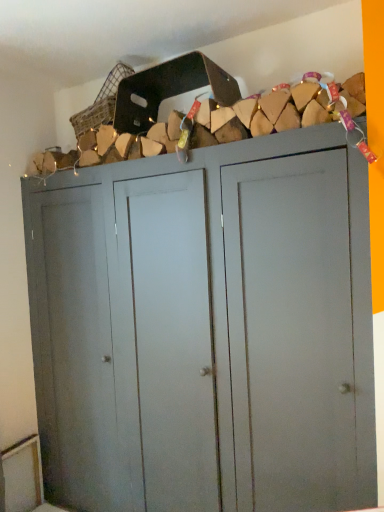
Describe the element at coordinates (101, 102) in the screenshot. I see `woven wicker basket at upper center` at that location.

Identify the location of woven wicker basket at upper center. This screenshot has width=384, height=512. (101, 102).

The height and width of the screenshot is (512, 384). What do you see at coordinates (206, 329) in the screenshot?
I see `matte gray cupboard at center` at bounding box center [206, 329].

Find the location of `matte gray cupboard at center`. matte gray cupboard at center is located at coordinates (206, 329).

This screenshot has height=512, width=384. What are the coordinates of `woven wicker basket at upper center` in the screenshot? It's located at (101, 102).

Between matte gray cupboard at center and woven wicker basket at upper center, which one appears on the left side from the viewer's perspective?

woven wicker basket at upper center.

Is matte gray cupboard at center further to camera compared to woven wicker basket at upper center?

No, the depth of matte gray cupboard at center is less than that of woven wicker basket at upper center.

Considering the positions of point (97, 169) and point (116, 89), is point (97, 169) closer or farther from the camera than point (116, 89)?

Point (97, 169) is farther from the camera than point (116, 89).

From the image's perspective, is matte gray cupboard at center below woven wicker basket at upper center?

Yes, from the image's perspective, matte gray cupboard at center is beneath woven wicker basket at upper center.

From a real-world perspective, who is located higher, matte gray cupboard at center or woven wicker basket at upper center?

woven wicker basket at upper center.

Which object is thinner, matte gray cupboard at center or woven wicker basket at upper center?

With smaller width is woven wicker basket at upper center.

Looking at this image, can you confirm if matte gray cupboard at center is shorter than woven wicker basket at upper center?

Incorrect, the height of matte gray cupboard at center does not fall short of that of woven wicker basket at upper center.

Considering the sizes of objects matte gray cupboard at center and woven wicker basket at upper center in the image provided, who is bigger, matte gray cupboard at center or woven wicker basket at upper center?

Bigger between the two is matte gray cupboard at center.

Is woven wicker basket at upper center completely or partially inside matte gray cupboard at center?

Definitely not — woven wicker basket at upper center is not inside matte gray cupboard at center.

Would you say matte gray cupboard at center is a long distance from woven wicker basket at upper center?

No, matte gray cupboard at center is in close proximity to woven wicker basket at upper center.

Is matte gray cupboard at center turned away from woven wicker basket at upper center?

No, woven wicker basket at upper center is not at the back of matte gray cupboard at center.

How different are the orientations of matte gray cupboard at center and woven wicker basket at upper center in degrees?

The facing directions of matte gray cupboard at center and woven wicker basket at upper center are 1.68 degrees apart.

Identify the location of basket on the left of the matte gray cupboard at center. click(101, 102).

Does woven wicker basket at upper center appear on the left side of matte gray cupboard at center?

Correct, you'll find woven wicker basket at upper center to the left of matte gray cupboard at center.

Is the depth of woven wicker basket at upper center greater than that of matte gray cupboard at center?

Yes, it is behind matte gray cupboard at center.

Is point (77, 133) more distant than point (349, 343)?

Yes.

From the image's perspective, would you say woven wicker basket at upper center is positioned over matte gray cupboard at center?

Yes, from the image's perspective, woven wicker basket at upper center is on top of matte gray cupboard at center.

From the picture: From a real-world perspective, who is located lower, woven wicker basket at upper center or matte gray cupboard at center?

From a 3D spatial view, matte gray cupboard at center is below.

In terms of width, does woven wicker basket at upper center look wider or thinner when compared to matte gray cupboard at center?

Considering their sizes, woven wicker basket at upper center looks slimmer than matte gray cupboard at center.

Can you confirm if woven wicker basket at upper center is shorter than matte gray cupboard at center?

Yes.

Considering the relative sizes of woven wicker basket at upper center and matte gray cupboard at center in the image provided, is woven wicker basket at upper center bigger than matte gray cupboard at center?

No.

Is woven wicker basket at upper center completely or partially outside of matte gray cupboard at center?

woven wicker basket at upper center lies outside matte gray cupboard at center's area.

Is woven wicker basket at upper center not near matte gray cupboard at center?

woven wicker basket at upper center is actually quite close to matte gray cupboard at center.

Is woven wicker basket at upper center positioned with its back to matte gray cupboard at center?

No, woven wicker basket at upper center is not facing away from matte gray cupboard at center.

You are a GUI agent. You are given a task and a screenshot of the screen. Output one action in this format:
    pyautogui.click(x=<x>, y=<y>)
    Task: Click on the basket above the matte gray cupboard at center (from the image's perspective)
    The width and height of the screenshot is (384, 512).
    Given the screenshot: What is the action you would take?
    pyautogui.click(x=101, y=102)

Image resolution: width=384 pixels, height=512 pixels. I want to click on cupboard on the right side of woven wicker basket at upper center, so click(206, 329).

This screenshot has width=384, height=512. I want to click on cupboard below the woven wicker basket at upper center (from the image's perspective), so click(206, 329).